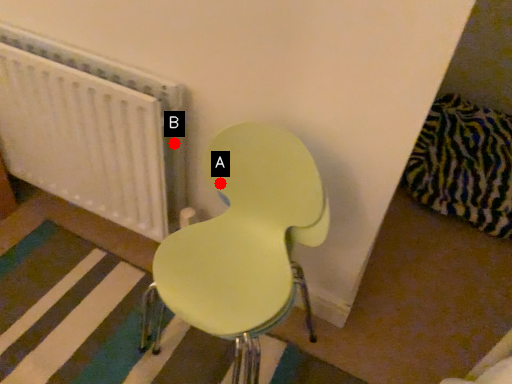
Question: Two points are circled on the image, labeled by A and B beside each circle. Which point is closer to the camera?

Choices:
 (A) A is closer
 (B) B is closer

Answer: (A)